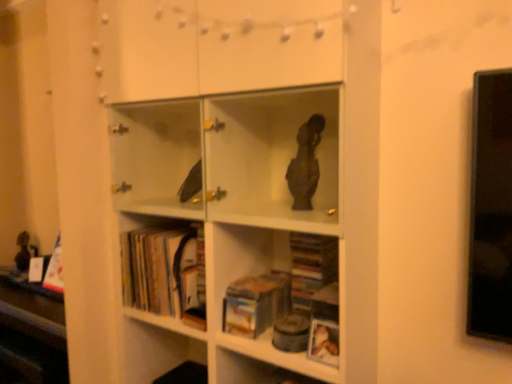
At what (x,y) coordinates should I click in order to perform the action: click on free space above hardcover book at center, positioned as the first book in right-to-left order (from a real-world perspective). Please return your answer as a coordinate pair (x, y). Looking at the image, I should click on (257, 284).